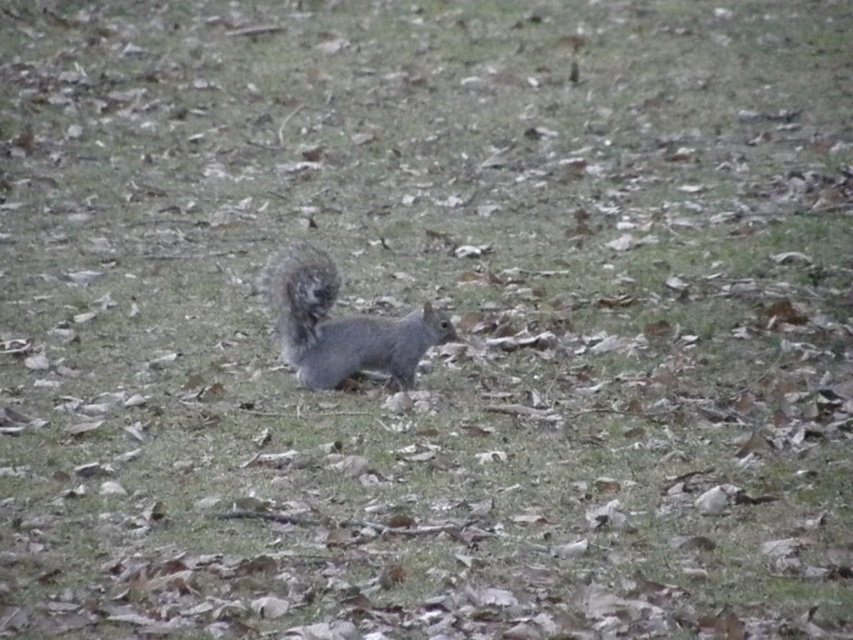
Question: Does fuzzy gray squirrel at center appear on the left side of fuzzy gray tail at center?

Choices:
 (A) no
 (B) yes

Answer: (B)

Question: Is fuzzy gray squirrel at center behind fuzzy gray tail at center?

Choices:
 (A) yes
 (B) no

Answer: (B)

Question: Is fuzzy gray squirrel at center to the right of fuzzy gray tail at center from the viewer's perspective?

Choices:
 (A) yes
 (B) no

Answer: (B)

Question: Which of the following is the farthest from the observer?

Choices:
 (A) fuzzy gray squirrel at center
 (B) fuzzy gray tail at center

Answer: (B)